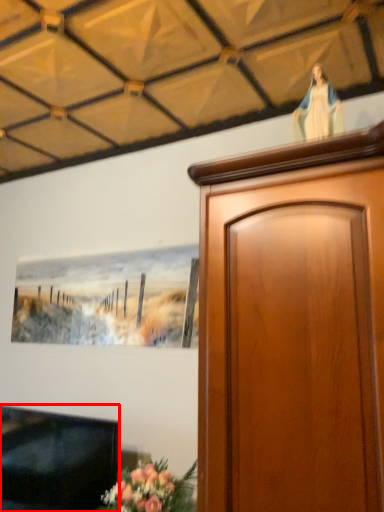
Question: From the image's perspective, what is the correct spatial positioning of television (annotated by the red box) in reference to woman?

Choices:
 (A) above
 (B) below

Answer: (B)